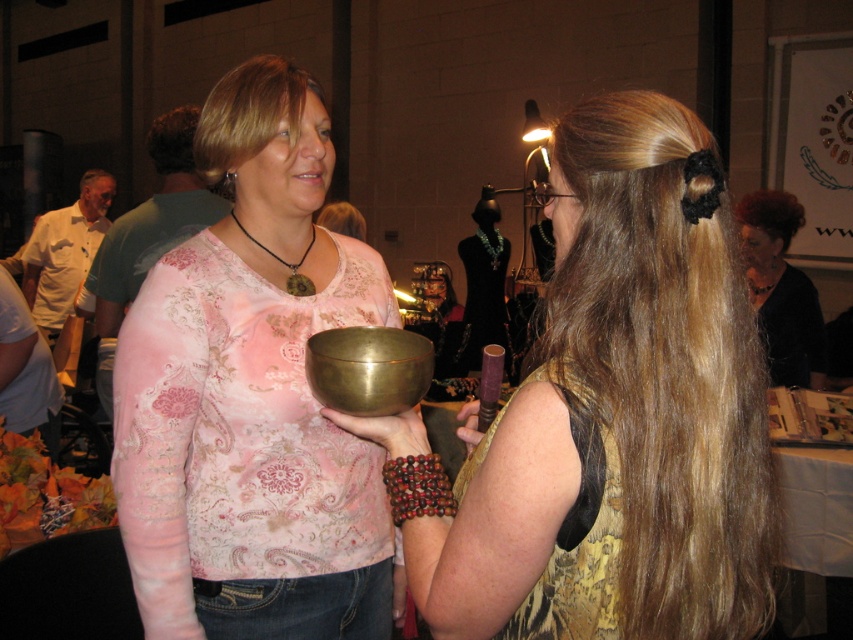
You are a photographer at the event and want to capture a photo of the metallic gold bowl at center and the blonde hair at upper center. Considering their heights, which object should be positioned lower in the frame to ensure both are fully visible?

The metallic gold bowl at center is taller than blonde hair at upper center, so to ensure both are fully visible in the photo, the metallic gold bowl at center should be positioned lower in the frame.

You are attending an indoor craft fair and notice two items in the image. One is a metallic gold bowl at center and the other is blonde hair at upper center. Based on their positions, which item is located to the right side of the other?

The metallic gold bowl at center is to the right of blonde hair at upper center.

You are attending an indoor craft fair and notice two items in the image. One is the metallic gold bowl at center and the other is the dark red hair at upper right. Based on their positions, which item is located more to the left?

The metallic gold bowl at center is positioned on the left side of dark red hair at upper right, so it is more to the left.